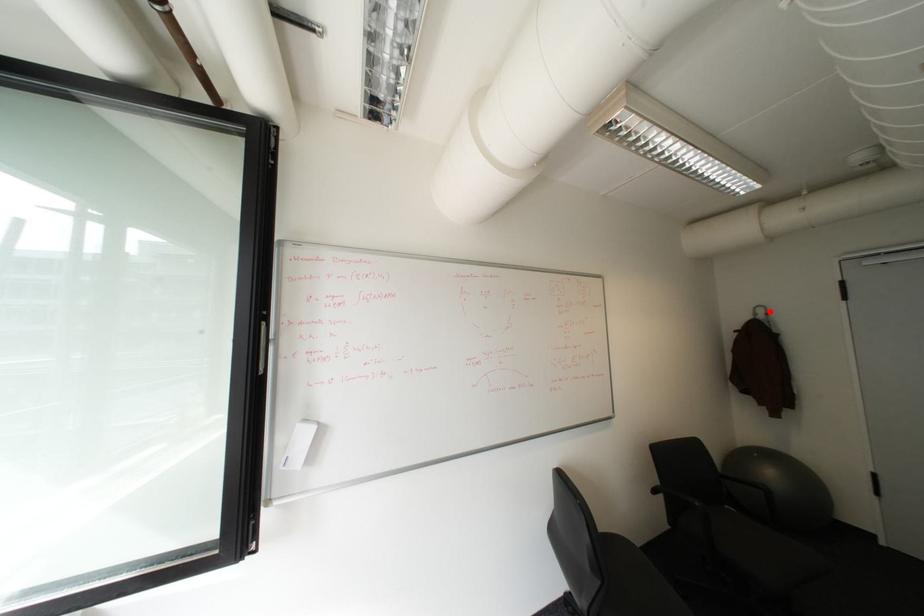
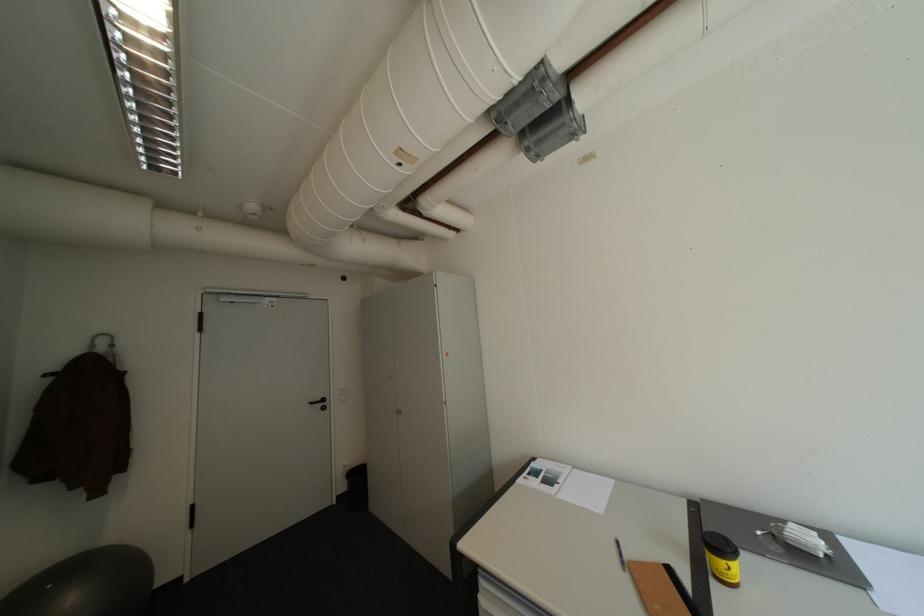
Locate, in the second image, the point that corresponds to the highlighted location in the first image.

(113, 342)